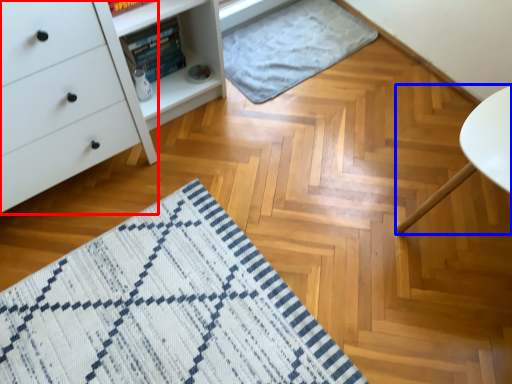
Question: Which object is closer to the camera taking this photo, chest of drawers (highlighted by a red box) or furniture (highlighted by a blue box)?

Choices:
 (A) chest of drawers
 (B) furniture

Answer: (A)